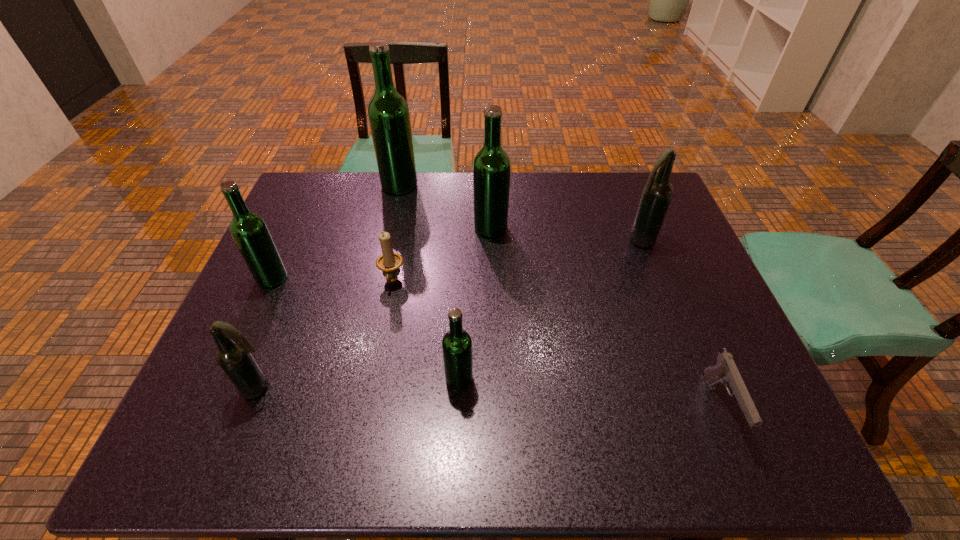
I want to click on vacant space in between the seventh tallest object and the smallest green beer bottle, so click(x=425, y=329).

You are a GUI agent. You are given a task and a screenshot of the screen. Output one action in this format:
    pyautogui.click(x=<x>, y=<y>)
    Task: Click on the free space between the right dark beer bottle and the leftmost green beer bottle
    This screenshot has height=540, width=960.
    Given the screenshot: What is the action you would take?
    pyautogui.click(x=455, y=259)

The image size is (960, 540). I want to click on vacant area between the second tallest object and the left dark beer bottle, so click(x=375, y=308).

Image resolution: width=960 pixels, height=540 pixels. I want to click on free space between the leftmost beer bottle and the nearest green beer bottle, so click(x=366, y=328).

The height and width of the screenshot is (540, 960). Find the location of `free space between the nearer dark beer bottle and the pistol`. free space between the nearer dark beer bottle and the pistol is located at coordinates (491, 397).

Identify the location of free point between the leftmost object and the bigger dark beer bottle. This screenshot has height=540, width=960. (455, 259).

Where is `free area in between the smallest green beer bottle and the seventh tallest object`? This screenshot has width=960, height=540. free area in between the smallest green beer bottle and the seventh tallest object is located at coordinates (425, 329).

You are a GUI agent. You are given a task and a screenshot of the screen. Output one action in this format:
    pyautogui.click(x=<x>, y=<y>)
    Task: Click on the second closest object relative to the third nearest green beer bottle
    
    Given the screenshot: What is the action you would take?
    pyautogui.click(x=388, y=112)

Find the location of `the seventh closest object to the seventh shortest object`. the seventh closest object to the seventh shortest object is located at coordinates (233, 355).

Locate which beer bottle ranks second in proximity to the second tallest beer bottle. Please provide its 2D coordinates. Your answer should be formatted as a tuple, i.e. [(x, y)], where the tuple contains the x and y coordinates of a point satisfying the conditions above.

[(657, 193)]